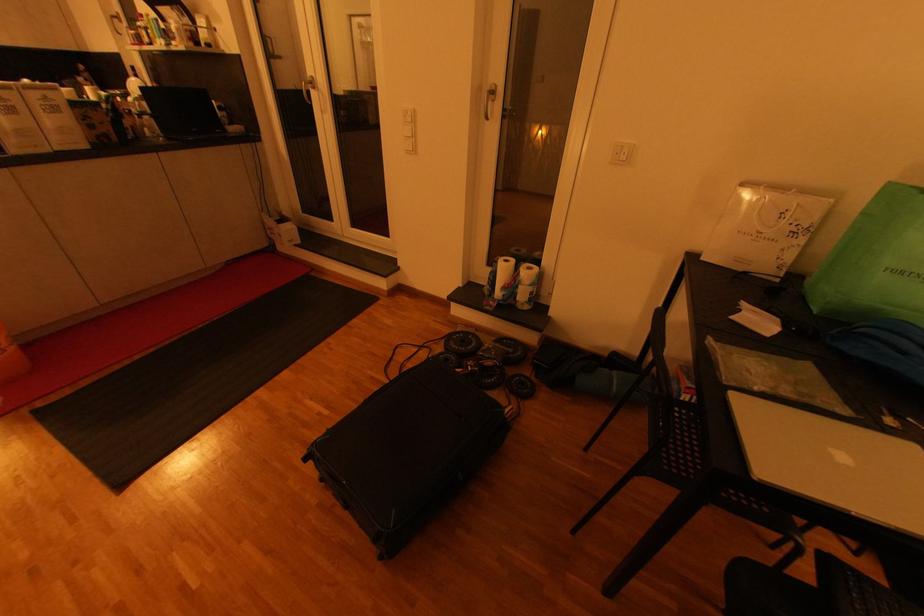
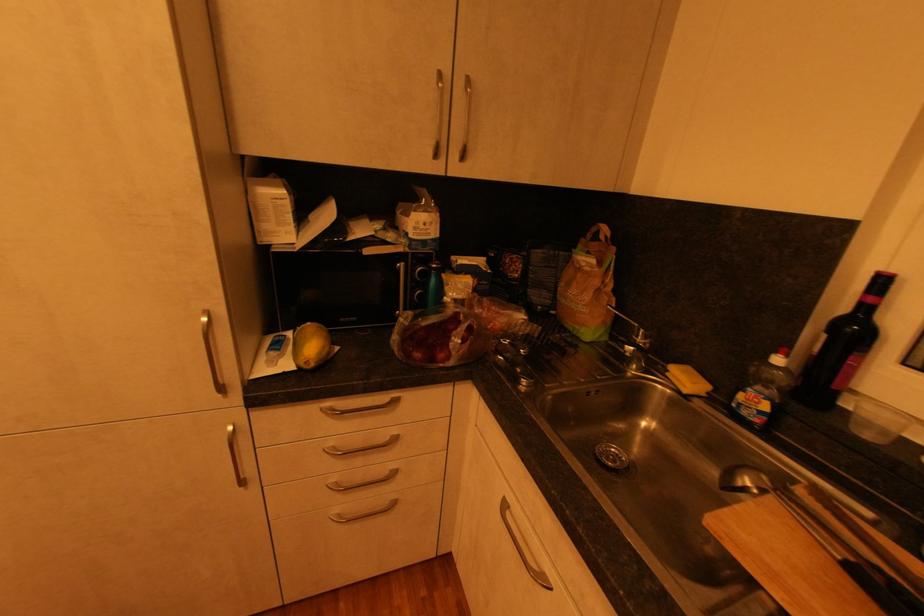
In the second image, find the point that corresponds to pixel 138 69 in the first image.

(889, 282)